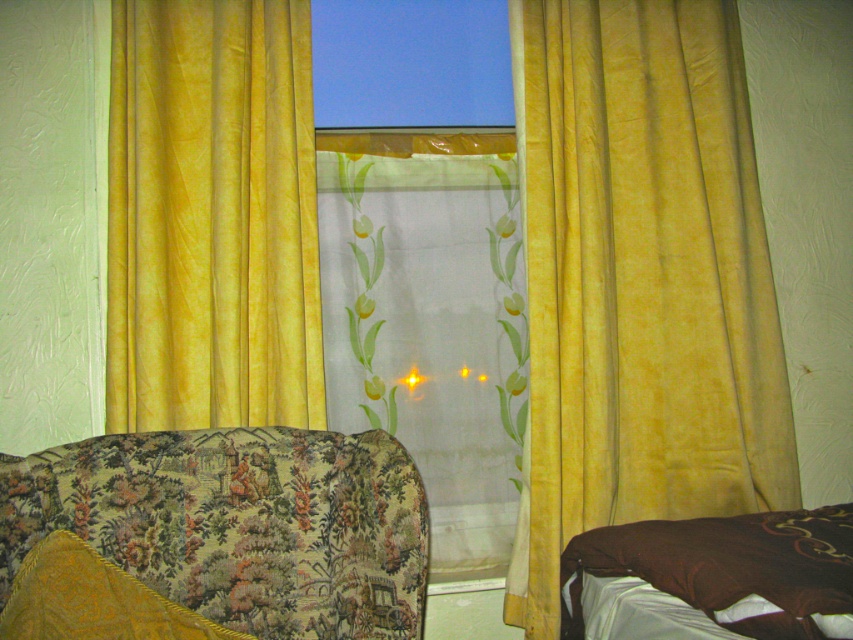
Question: Among these points, which one is nearest to the camera?

Choices:
 (A) (584, 548)
 (B) (137, 598)
 (C) (386, 353)

Answer: (B)

Question: From the image, what is the correct spatial relationship of yellow velvet curtains at left in relation to brown soft pillow at lower right?

Choices:
 (A) right
 (B) left

Answer: (B)

Question: Considering the relative positions of yellow velvet curtain at center and floral fabric armchair at lower left in the image provided, where is yellow velvet curtain at center located with respect to floral fabric armchair at lower left?

Choices:
 (A) above
 (B) below

Answer: (A)

Question: Among these points, which one is nearest to the camera?

Choices:
 (A) (746, 545)
 (B) (492, 508)
 (C) (45, 492)

Answer: (C)

Question: Does yellow velvet curtain at center have a lesser width compared to yellow velvet curtains at left?

Choices:
 (A) no
 (B) yes

Answer: (A)

Question: Which point is farther from the camera taking this photo?

Choices:
 (A) 814,557
 (B) 119,573

Answer: (A)